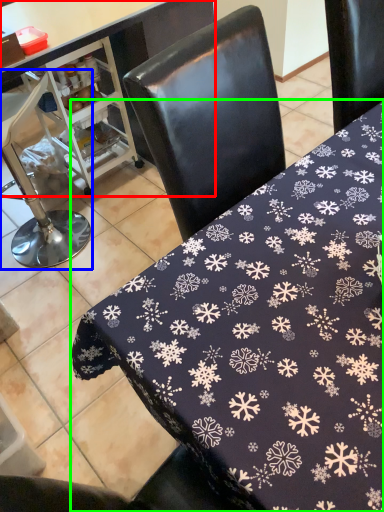
Question: Which object is positioned farthest from table (highlighted by a red box)? Select from chair (highlighted by a blue box) and table (highlighted by a green box).

Choices:
 (A) chair
 (B) table

Answer: (B)